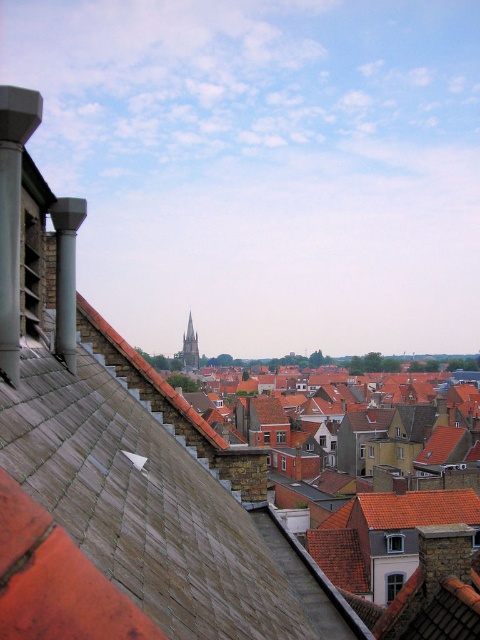
You are an architect planning to install a new antenna on the tallest structure in the scene. Which structure should you choose between the brown tiled roofs at center and the smooth gray stone tower at center?

The smooth gray stone tower at center is taller than the brown tiled roofs at center, so you should choose the smooth gray stone tower at center to install the antenna.

You are an architect planning to install solar panels on the brown tiled roofs at center and the smooth gray stone tower at center. Considering their widths, which structure would allow for more solar panels to be installed?

The brown tiled roofs at center have a greater width than the smooth gray stone tower at center, so they can accommodate more solar panels.